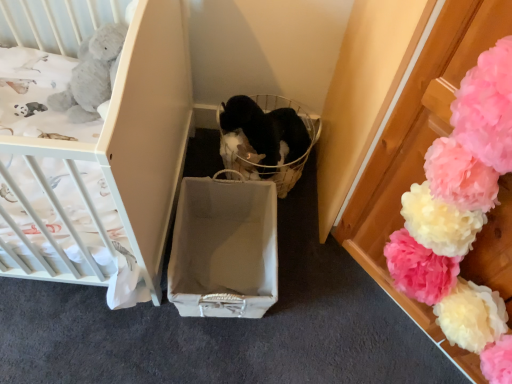
Locate an element on the screen. empty space that is to the right of matte gray cardboard box at center is located at coordinates (316, 291).